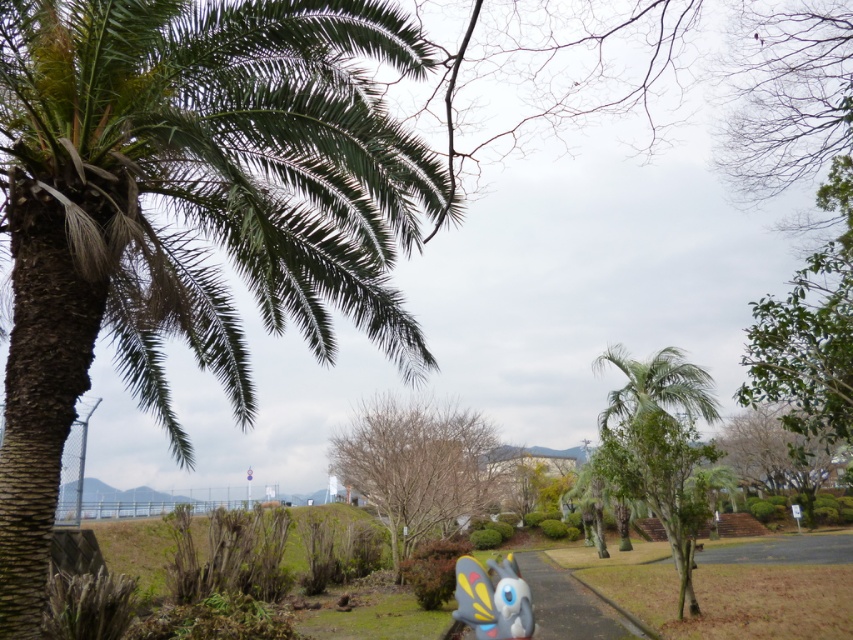
Question: Estimate the real-world distances between objects in this image. Which object is closer to the gray asphalt pavement at lower center?

Choices:
 (A) green leafy palm tree at center
 (B) bare wood tree at center
 (C) matte plastic butterfly at lower center

Answer: (A)

Question: Can you confirm if green leafy palm tree at center is bigger than gray asphalt pavement at lower center?

Choices:
 (A) no
 (B) yes

Answer: (A)

Question: Which of the following is the farthest from the observer?

Choices:
 (A) green leafy palm at left
 (B) gray asphalt pavement at lower center
 (C) green leafy palm tree at center
 (D) matte plastic butterfly at lower center

Answer: (C)

Question: Can you confirm if green leafy palm tree at center is smaller than matte plastic butterfly at lower center?

Choices:
 (A) no
 (B) yes

Answer: (A)

Question: Which point appears closest to the camera in this image?

Choices:
 (A) (480, 461)
 (B) (480, 586)
 (C) (9, 483)
 (D) (674, 372)

Answer: (C)

Question: Does bare wood tree at center appear on the right side of green leafy palm tree at center?

Choices:
 (A) yes
 (B) no

Answer: (B)